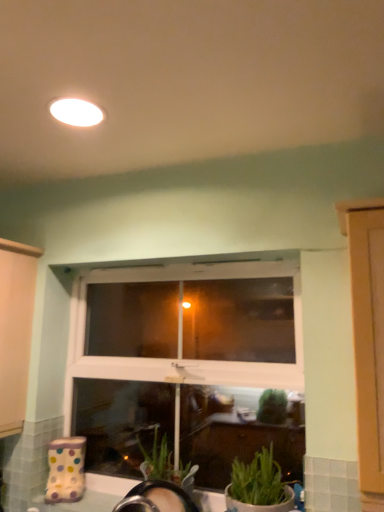
Find the location of a particular element. white matte light fixture at upper center is located at coordinates (76, 112).

This screenshot has height=512, width=384. What do you see at coordinates (76, 112) in the screenshot?
I see `white matte light fixture at upper center` at bounding box center [76, 112].

This screenshot has height=512, width=384. What do you see at coordinates (258, 485) in the screenshot?
I see `green matte plant at lower right` at bounding box center [258, 485].

Where is `white plastic window at center`? The width and height of the screenshot is (384, 512). white plastic window at center is located at coordinates (185, 364).

In order to click on white matte light fixture at upper center in this screenshot , I will do `click(76, 112)`.

Which is behind, green matte plant at lower right or white matte light fixture at upper center?

green matte plant at lower right is more distant.

Who is taller, green matte plant at lower right or white matte light fixture at upper center?

green matte plant at lower right is taller.

At what (x,y) coordinates should I click in order to perform the action: click on lighting above the green matte plant at lower right (from a real-world perspective). Please return your answer as a coordinate pair (x, y). Image resolution: width=384 pixels, height=512 pixels. Looking at the image, I should click on [x=76, y=112].

Is white matte light fixture at upper center at the back of green matte plant at lower right?

No, green matte plant at lower right is not facing the opposite direction of white matte light fixture at upper center.

Would you say white plastic window at center is outside white matte light fixture at upper center?

white plastic window at center lies outside white matte light fixture at upper center's area.

Is point (152, 279) farther from viewer compared to point (52, 105)?

That is True.

Can you tell me how much white plastic window at center and white matte light fixture at upper center differ in facing direction?

They differ by 90.4 degrees in their facing directions.

In order to click on lighting above the white plastic window at center (from a real-world perspective) in this screenshot , I will do `click(76, 112)`.

Which is more to the right, white matte light fixture at upper center or white plastic window at center?

Positioned to the right is white plastic window at center.

From a real-world perspective, is white matte light fixture at upper center beneath white plastic window at center?

No, from a real-world perspective, white matte light fixture at upper center is not beneath white plastic window at center.

Can you confirm if white matte light fixture at upper center is bigger than white plastic window at center?

Incorrect, white matte light fixture at upper center is not larger than white plastic window at center.

Could you tell me if white matte light fixture at upper center is turned towards white plastic window at center?

No, white matte light fixture at upper center is not turned towards white plastic window at center.

Is white plastic window at center with green matte plant at lower right?

white plastic window at center and green matte plant at lower right are clearly separated.

Is white plastic window at center further to camera compared to green matte plant at lower right?

Yes, it is behind green matte plant at lower right.

Is white plastic window at center oriented away from green matte plant at lower right?

Yes, white plastic window at center is facing away from green matte plant at lower right.

The width and height of the screenshot is (384, 512). I want to click on houseplant lying below the white plastic window at center (from the image's perspective), so click(x=258, y=485).

You are a GUI agent. You are given a task and a screenshot of the screen. Output one action in this format:
    pyautogui.click(x=<x>, y=<y>)
    Task: Click on the window behind the green matte plant at lower right
    Image resolution: width=384 pixels, height=512 pixels.
    Given the screenshot: What is the action you would take?
    pyautogui.click(x=185, y=364)

In the scene shown: Is white plastic window at center at the back of green matte plant at lower right?

That's right, green matte plant at lower right is facing away from white plastic window at center.

Is green matte plant at lower right wider than white plastic window at center?

Yes, green matte plant at lower right is wider than white plastic window at center.

Considering the positions of objects green matte plant at lower right and white plastic window at center in the image provided, who is more to the left, green matte plant at lower right or white plastic window at center?

From the viewer's perspective, white plastic window at center appears more on the left side.

Does white matte light fixture at upper center have a smaller size compared to green matte plant at lower right?

Yes, white matte light fixture at upper center is smaller than green matte plant at lower right.

Where is `houseplant below the white matte light fixture at upper center (from the image's perspective)`? The width and height of the screenshot is (384, 512). houseplant below the white matte light fixture at upper center (from the image's perspective) is located at coordinates (258, 485).

From the picture: Which of these two, white matte light fixture at upper center or green matte plant at lower right, stands shorter?

white matte light fixture at upper center is shorter.

Locate an element on the screen. This screenshot has height=512, width=384. houseplant that appears on the right of white matte light fixture at upper center is located at coordinates (258, 485).

This screenshot has width=384, height=512. Find the location of `lighting positioned vertically above the white plastic window at center (from a real-world perspective)`. lighting positioned vertically above the white plastic window at center (from a real-world perspective) is located at coordinates (76, 112).

When comparing their distances from green matte plant at lower right, does white plastic window at center or white matte light fixture at upper center seem further?

Based on the image, white matte light fixture at upper center appears to be further to green matte plant at lower right.

Looking at this image, which object lies further to the anchor point white matte light fixture at upper center, green matte plant at lower right or white plastic window at center?

The object further to white matte light fixture at upper center is green matte plant at lower right.

From the image, which object appears to be nearer to white plastic window at center, white matte light fixture at upper center or green matte plant at lower right?

green matte plant at lower right is positioned closer to the anchor white plastic window at center.

From the image, which object appears to be farther from green matte plant at lower right, white matte light fixture at upper center or white plastic window at center?

white matte light fixture at upper center lies further to green matte plant at lower right than the other object.

From the image, which object appears to be nearer to white plastic window at center, green matte plant at lower right or white matte light fixture at upper center?

green matte plant at lower right is positioned closer to the anchor white plastic window at center.

Considering their positions, is white plastic window at center positioned closer to white matte light fixture at upper center than green matte plant at lower right?

white plastic window at center lies closer to white matte light fixture at upper center than the other object.

At what (x,y) coordinates should I click in order to perform the action: click on window between white matte light fixture at upper center and green matte plant at lower right in the up-down direction. Please return your answer as a coordinate pair (x, y). This screenshot has height=512, width=384. Looking at the image, I should click on (185, 364).